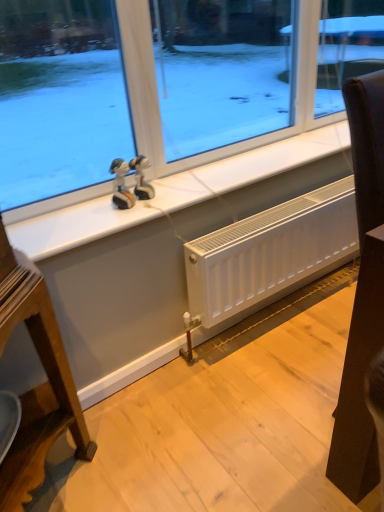
How much space does glossy plastic figurine at upper center, which is counted as the first figurine, starting from the right, occupy horizontally?

It is 7.52 centimeters.

Image resolution: width=384 pixels, height=512 pixels. Describe the element at coordinates (248, 167) in the screenshot. I see `white tile at upper center` at that location.

In order to click on glossy plastic figurine at upper center, marked as the second figurine in a left-to-right arrangement in this screenshot , I will do `click(141, 178)`.

Image resolution: width=384 pixels, height=512 pixels. I want to click on window sill located above the white matte radiator at lower center (from a real-world perspective), so click(x=248, y=167).

Considering the relative sizes of white tile at upper center and white matte radiator at lower center in the image provided, is white tile at upper center thinner than white matte radiator at lower center?

No.

Can you confirm if white tile at upper center is shorter than white matte radiator at lower center?

Correct, white tile at upper center is not as tall as white matte radiator at lower center.

Would you say white tile at upper center is outside white matte radiator at lower center?

white tile at upper center is positioned outside white matte radiator at lower center.

Considering the relative sizes of black leather chair at right and white matte radiator at lower center in the image provided, is black leather chair at right wider than white matte radiator at lower center?

Correct, the width of black leather chair at right exceeds that of white matte radiator at lower center.

From a real-world perspective, relative to white matte radiator at lower center, is black leather chair at right vertically above or below?

Clearly, from a real-world perspective, black leather chair at right is above white matte radiator at lower center.

Would you consider black leather chair at right to be distant from white matte radiator at lower center?

No.

Do you think black leather chair at right is within white matte radiator at lower center, or outside of it?

black leather chair at right is located beyond the bounds of white matte radiator at lower center.

Looking at this image, considering the sizes of objects white tile at upper center and matte plastic figurine at center, the second figurine from the right, in the image provided, who is wider, white tile at upper center or matte plastic figurine at center, the second figurine from the right,?

white tile at upper center is wider.

Is white tile at upper center surrounding matte plastic figurine at center, the second figurine from the right?

No, matte plastic figurine at center, the second figurine from the right, is located outside of white tile at upper center.

Is glossy plastic figurine at upper center, which is counted as the first figurine, starting from the right, oriented towards black leather chair at right?

No, glossy plastic figurine at upper center, which is counted as the first figurine, starting from the right, is not aimed at black leather chair at right.

From a real-world perspective, is glossy plastic figurine at upper center, which is counted as the first figurine, starting from the right, positioned above or below black leather chair at right?

From a real-world perspective, glossy plastic figurine at upper center, which is counted as the first figurine, starting from the right, is physically above black leather chair at right.

Does point (153, 190) come closer to viewer compared to point (380, 217)?

No, it is not.

Could you measure the distance between glossy plastic figurine at upper center, which is counted as the first figurine, starting from the right, and black leather chair at right?

glossy plastic figurine at upper center, which is counted as the first figurine, starting from the right, and black leather chair at right are 30.03 inches apart.

Can you tell me how much white tile at upper center and glossy plastic figurine at upper center, marked as the second figurine in a left-to-right arrangement, differ in facing direction?

The facing directions of white tile at upper center and glossy plastic figurine at upper center, marked as the second figurine in a left-to-right arrangement, are 0.000136 degrees apart.

Would you say white tile at upper center is a long distance from glossy plastic figurine at upper center, which is counted as the first figurine, starting from the right?

No.

From a real-world perspective, starting from the white tile at upper center, which figurine is the 1st one vertically above it? Please provide its 2D coordinates.

[(141, 178)]

From a real-world perspective, is white tile at upper center on glossy plastic figurine at upper center, which is counted as the first figurine, starting from the right?

No, from a real-world perspective, white tile at upper center is not over glossy plastic figurine at upper center, which is counted as the first figurine, starting from the right

Is matte plastic figurine at center, the second figurine from the right, in front of or behind white matte radiator at lower center in the image?

In the image, matte plastic figurine at center, the second figurine from the right, appears in front of white matte radiator at lower center.

Is matte plastic figurine at center, which ranks as the 1th figurine in left-to-right order, in contact with white matte radiator at lower center?

There is a gap between matte plastic figurine at center, which ranks as the 1th figurine in left-to-right order, and white matte radiator at lower center.

Measure the distance from matte plastic figurine at center, which ranks as the 1th figurine in left-to-right order, to white matte radiator at lower center.

A distance of 21.71 inches exists between matte plastic figurine at center, which ranks as the 1th figurine in left-to-right order, and white matte radiator at lower center.

Does matte plastic figurine at center, which ranks as the 1th figurine in left-to-right order, contain white matte radiator at lower center?

No, white matte radiator at lower center is not a part of matte plastic figurine at center, which ranks as the 1th figurine in left-to-right order.

From a real-world perspective, who is located lower, glossy plastic figurine at upper center, marked as the second figurine in a left-to-right arrangement, or matte plastic figurine at center, the second figurine from the right?

In real-world perspective, glossy plastic figurine at upper center, marked as the second figurine in a left-to-right arrangement, is lower.

Is point (152, 193) farther from camera compared to point (131, 204)?

That is True.

Consider the image. Is glossy plastic figurine at upper center, which is counted as the first figurine, starting from the right, positioned beyond the bounds of matte plastic figurine at center, which ranks as the 1th figurine in left-to-right order?

glossy plastic figurine at upper center, which is counted as the first figurine, starting from the right, is positioned outside matte plastic figurine at center, which ranks as the 1th figurine in left-to-right order.

Image resolution: width=384 pixels, height=512 pixels. I want to click on window sill located on the left of white matte radiator at lower center, so tap(248, 167).

You are a GUI agent. You are given a task and a screenshot of the screen. Output one action in this format:
    pyautogui.click(x=<x>, y=<y>)
    Task: Click on the furniture that is above the white matte radiator at lower center (from a real-world perspective)
    
    Given the screenshot: What is the action you would take?
    pyautogui.click(x=362, y=294)

Looking at the image, which one is located further to white tile at upper center, glossy plastic figurine at upper center, marked as the second figurine in a left-to-right arrangement, or black leather chair at right?

black leather chair at right.

Which object lies further to the anchor point glossy plastic figurine at upper center, which is counted as the first figurine, starting from the right, matte plastic figurine at center, the second figurine from the right, or white matte radiator at lower center?

white matte radiator at lower center lies further to glossy plastic figurine at upper center, which is counted as the first figurine, starting from the right, than the other object.

When comparing their distances from glossy plastic figurine at upper center, marked as the second figurine in a left-to-right arrangement, does white matte radiator at lower center or matte plastic figurine at center, the second figurine from the right, seem further?

white matte radiator at lower center.

Which object lies nearer to the anchor point black leather chair at right, white matte radiator at lower center or glossy plastic figurine at upper center, marked as the second figurine in a left-to-right arrangement?

white matte radiator at lower center lies closer to black leather chair at right than the other object.

When comparing their distances from black leather chair at right, does white matte radiator at lower center or matte plastic figurine at center, which ranks as the 1th figurine in left-to-right order, seem further?

matte plastic figurine at center, which ranks as the 1th figurine in left-to-right order, is positioned further to the anchor black leather chair at right.

Estimate the real-world distances between objects in this image. Which object is further from matte plastic figurine at center, the second figurine from the right, black leather chair at right or glossy plastic figurine at upper center, which is counted as the first figurine, starting from the right?

Among the two, black leather chair at right is located further to matte plastic figurine at center, the second figurine from the right.

Considering their positions, is glossy plastic figurine at upper center, which is counted as the first figurine, starting from the right, positioned further to white tile at upper center than white matte radiator at lower center?

white matte radiator at lower center is positioned further to the anchor white tile at upper center.

Which object lies further to the anchor point white matte radiator at lower center, white tile at upper center or black leather chair at right?

black leather chair at right is further to white matte radiator at lower center.

Image resolution: width=384 pixels, height=512 pixels. Find the location of `radiator between matte plastic figurine at center, the second figurine from the right, and black leather chair at right, in the horizontal direction`. radiator between matte plastic figurine at center, the second figurine from the right, and black leather chair at right, in the horizontal direction is located at coordinates 268,254.

Image resolution: width=384 pixels, height=512 pixels. I want to click on figurine between matte plastic figurine at center, the second figurine from the right, and black leather chair at right, so click(x=141, y=178).

The image size is (384, 512). In order to click on window sill between glossy plastic figurine at upper center, marked as the second figurine in a left-to-right arrangement, and black leather chair at right, in the horizontal direction in this screenshot , I will do `click(248, 167)`.

The height and width of the screenshot is (512, 384). In order to click on figurine located between matte plastic figurine at center, the second figurine from the right, and white matte radiator at lower center in the left-right direction in this screenshot , I will do coord(141,178).